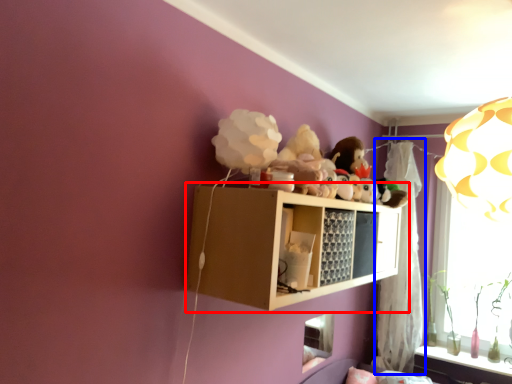
Question: Which object is closer to the camera taking this photo, shelf (highlighted by a red box) or curtain (highlighted by a blue box)?

Choices:
 (A) shelf
 (B) curtain

Answer: (A)